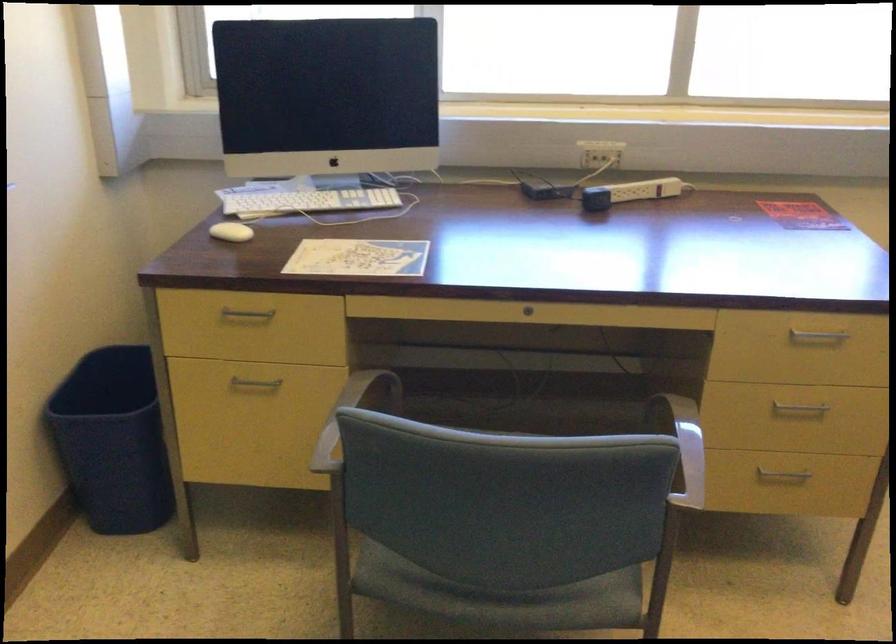
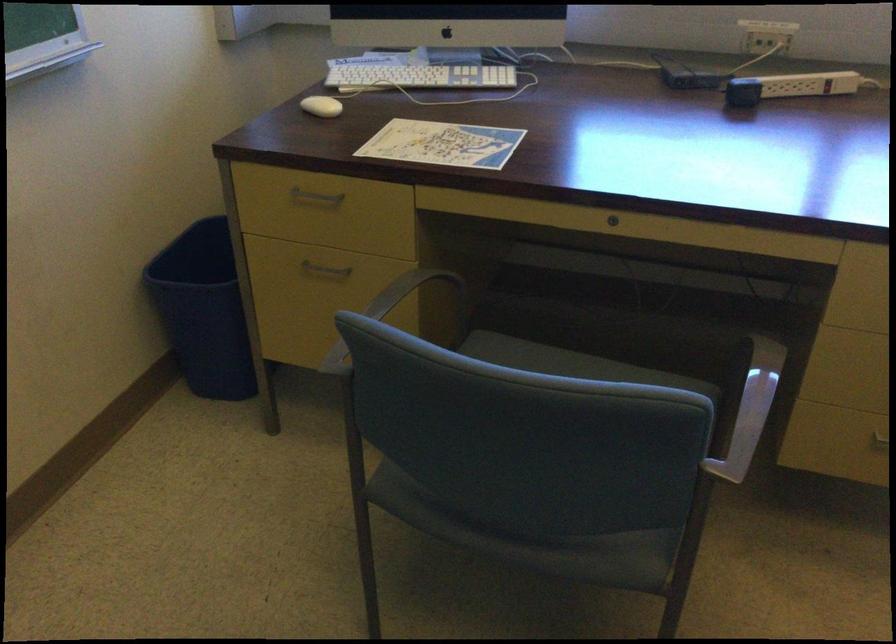
The point at (530,310) is marked in the first image. Where is the corresponding point in the second image?

(613, 220)